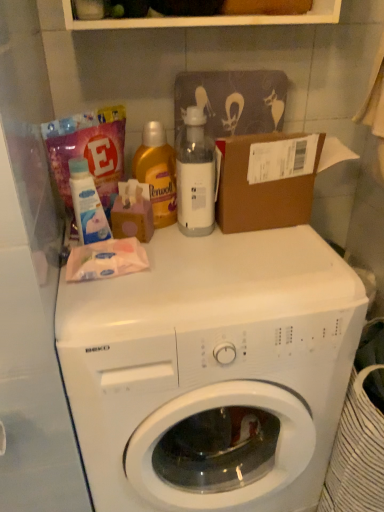
At what (x,y) coordinates should I click in order to perform the action: click on vacant area that is situated to the right of white glossy lotion at upper left, the 1th cleaning product in the left-to-right sequence. Please return your answer as a coordinate pair (x, y). Looking at the image, I should click on (180, 254).